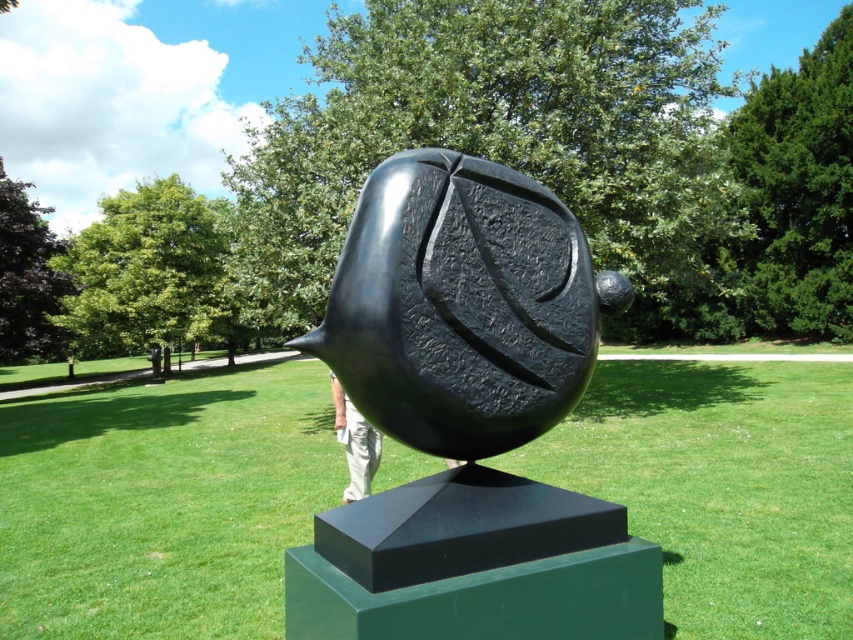
From the picture: You are standing in the park and see the black polished stone sphere at center and the tan fabric pants at center. Which object is nearer to you?

The black polished stone sphere at center is closer to the viewer than the tan fabric pants at center.

You are standing at the center of the image and want to walk towards the green grass at center. In which direction should you move relative to your current position?

The green grass at center is located at point (161,502) in the image. Since you are at the center, you should move towards the direction of the coordinates to reach it.

You are a park visitor who wants to take a photo of the black polished stone sphere at center and the tan fabric pants at center. Since you want both objects in the frame, which one should you zoom in or out to include both?

The black polished stone sphere at center is larger in size than the tan fabric pants at center, so you should zoom out to include both in the frame.